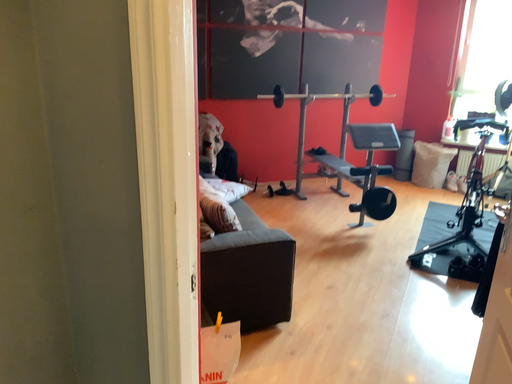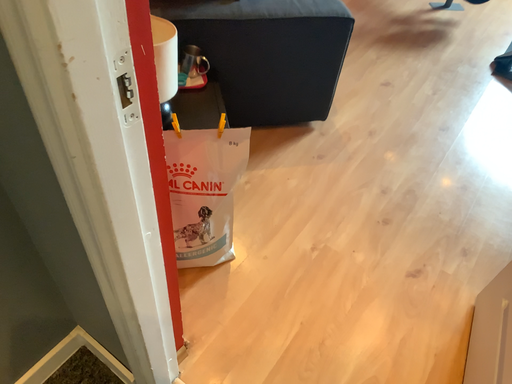
Question: Which way did the camera rotate in the video?

Choices:
 (A) rotated downward
 (B) rotated upward

Answer: (A)